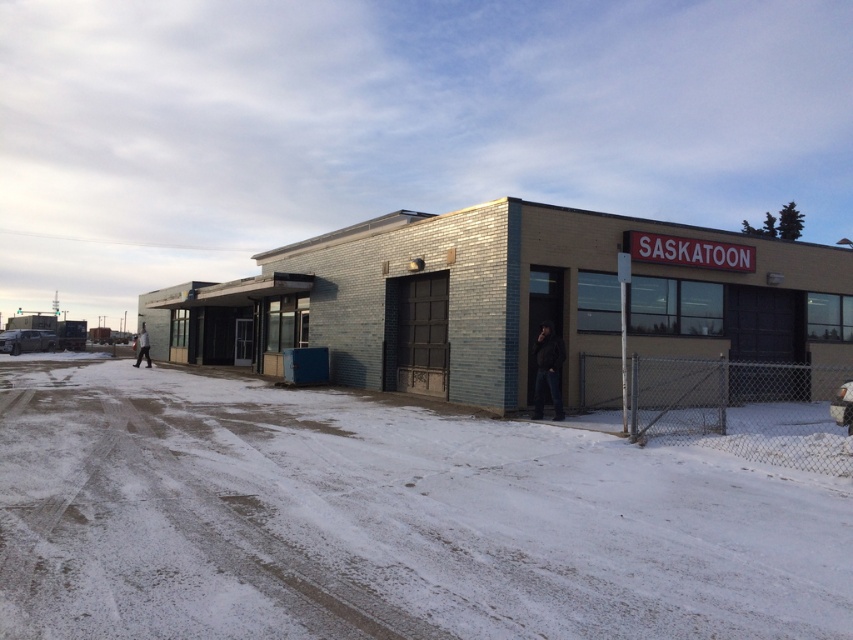
Does brick building at center have a lesser height compared to dark brown leather jacket at lower right?

No, brick building at center is not shorter than dark brown leather jacket at lower right.

Between point (418, 339) and point (538, 380), which one is positioned in front?

Point (538, 380) is in front.

Image resolution: width=853 pixels, height=640 pixels. What do you see at coordinates (509, 300) in the screenshot? I see `brick building at center` at bounding box center [509, 300].

I want to click on brick building at center, so (509, 300).

Which is more to the right, white powdery snow at lower center or brick building at center?

white powdery snow at lower center is more to the right.

At what (x,y) coordinates should I click in order to perform the action: click on white powdery snow at lower center. Please return your answer as a coordinate pair (x, y). The width and height of the screenshot is (853, 640). Looking at the image, I should click on (383, 520).

Who is more forward, (350, 625) or (561, 413)?

Point (350, 625)

Is white powdery snow at lower center smaller than dark brown leather jacket at lower right?

Actually, white powdery snow at lower center might be larger than dark brown leather jacket at lower right.

Which is in front, point (486, 540) or point (553, 396)?

Point (486, 540)

Where is `white powdery snow at lower center`? Image resolution: width=853 pixels, height=640 pixels. white powdery snow at lower center is located at coordinates (383, 520).